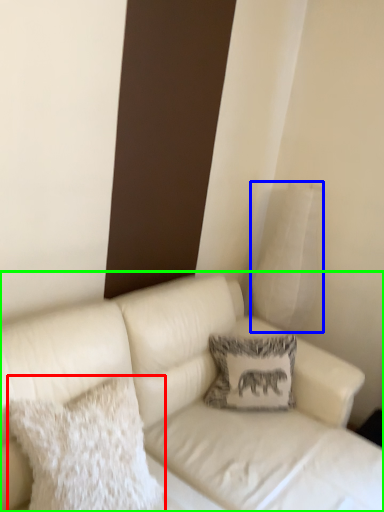
Question: Considering the real-world distances, which object is farthest from pillow (highlighted by a red box)? pillow (highlighted by a blue box) or studio couch (highlighted by a green box)?

Choices:
 (A) pillow
 (B) studio couch

Answer: (A)